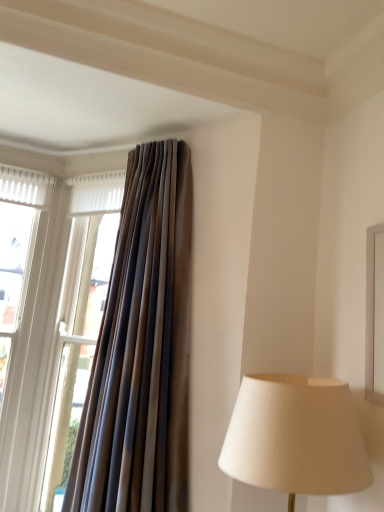
Question: Considering the positions of brown textured curtain at upper left and matte brown curtain at left in the image, is brown textured curtain at upper left wider or thinner than matte brown curtain at left?

Choices:
 (A) thin
 (B) wide

Answer: (B)

Question: Is brown textured curtain at upper left to the left or to the right of matte brown curtain at left in the image?

Choices:
 (A) right
 (B) left

Answer: (A)

Question: In terms of size, does brown textured curtain at upper left appear bigger or smaller than matte brown curtain at left?

Choices:
 (A) small
 (B) big

Answer: (B)

Question: Is matte brown curtain at left in front of or behind brown textured curtain at upper left in the image?

Choices:
 (A) behind
 (B) front

Answer: (A)

Question: From a real-world perspective, is matte brown curtain at left above or below brown textured curtain at upper left?

Choices:
 (A) above
 (B) below

Answer: (B)

Question: Is point (8, 436) positioned closer to the camera than point (132, 418)?

Choices:
 (A) farther
 (B) closer

Answer: (A)

Question: Would you say matte brown curtain at left is inside or outside brown textured curtain at upper left?

Choices:
 (A) outside
 (B) inside

Answer: (A)